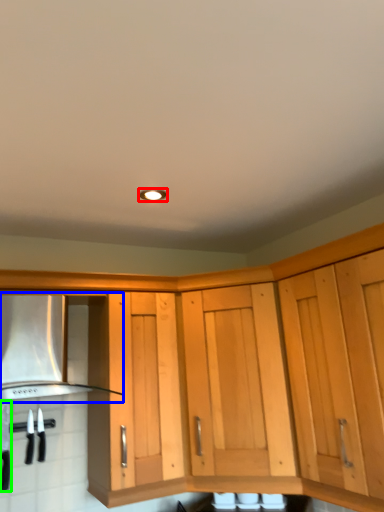
Question: Considering the real-world distances, which object is closest to lighting (highlighted by a red box)? vent (highlighted by a blue box) or kitchen appliance (highlighted by a green box).

Choices:
 (A) vent
 (B) kitchen appliance

Answer: (A)